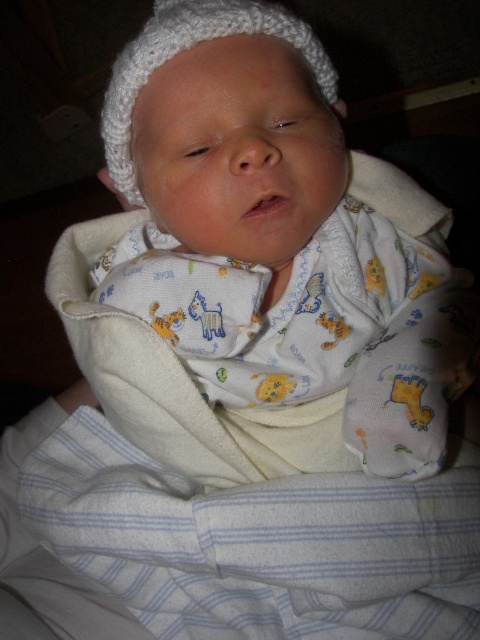
Where is the white striped blanket at lower left located in the image?

The white striped blanket at lower left is located at point [257,544] in the image.

In the scene shown: You are a photographer taking a picture of the baby. You need to position your camera so that both the point at [251,593] and the point at [110,80] are clearly visible. Which point should you focus on first to ensure the foreground is sharp?

You should focus on the point at [251,593] first because it is in front of the point at [110,80], making it the foreground element that needs sharpness.

You are a photographer taking a photo of the newborn baby. You want to ensure the white knitted hat at upper center and the white striped blanket at lower left are both clearly visible in the shot. However, you notice that one of them might be partially hidden. Which object is more likely to be obscured, and why?

The white knitted hat at upper center is behind the white striped blanket at lower left, so it is more likely to be partially obscured because it is positioned behind the blanket.